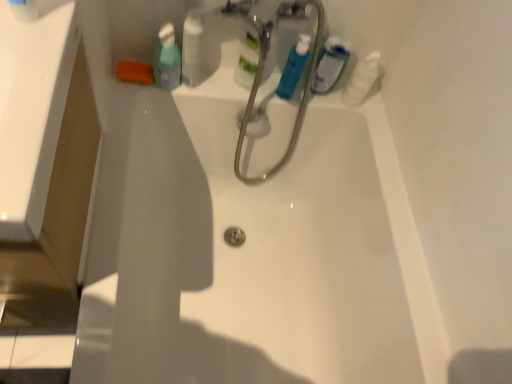
Question: From a real-world perspective, is white glossy bottle at upper center physically below translucent plastic mouthwash at upper center, acting as the 1th mouthwash starting from the left?

Choices:
 (A) yes
 (B) no

Answer: (B)

Question: Is white glossy bottle at upper center at the right side of translucent plastic mouthwash at upper center, acting as the 1th mouthwash starting from the left?

Choices:
 (A) yes
 (B) no

Answer: (A)

Question: Is white glossy bottle at upper center shorter than translucent plastic mouthwash at upper center, placed as the third mouthwash when sorted from right to left?

Choices:
 (A) yes
 (B) no

Answer: (B)

Question: Is white glossy bottle at upper center far away from translucent plastic mouthwash at upper center, placed as the third mouthwash when sorted from right to left?

Choices:
 (A) no
 (B) yes

Answer: (A)

Question: Is white glossy bottle at upper center facing towards translucent plastic mouthwash at upper center, acting as the 1th mouthwash starting from the left?

Choices:
 (A) yes
 (B) no

Answer: (B)

Question: From the image's perspective, is white glossy bottle at upper center on translucent plastic mouthwash at upper center, placed as the third mouthwash when sorted from right to left?

Choices:
 (A) yes
 (B) no

Answer: (A)

Question: Considering the relative sizes of white glossy bottle at upper center and translucent plastic mouthwash at upper right, which appears as the 1th mouthwash when viewed from the right, in the image provided, is white glossy bottle at upper center smaller than translucent plastic mouthwash at upper right, which appears as the 1th mouthwash when viewed from the right,?

Choices:
 (A) yes
 (B) no

Answer: (B)

Question: Is translucent plastic mouthwash at upper right, the 3th mouthwash in the left-to-right sequence, surrounded by white glossy bottle at upper center?

Choices:
 (A) no
 (B) yes

Answer: (A)

Question: Is white glossy bottle at upper center next to translucent plastic mouthwash at upper right, the 3th mouthwash in the left-to-right sequence?

Choices:
 (A) yes
 (B) no

Answer: (B)

Question: Does white glossy bottle at upper center have a lesser height compared to translucent plastic mouthwash at upper right, which appears as the 1th mouthwash when viewed from the right?

Choices:
 (A) yes
 (B) no

Answer: (B)

Question: From the image's perspective, is white glossy bottle at upper center below translucent plastic mouthwash at upper right, which appears as the 1th mouthwash when viewed from the right?

Choices:
 (A) yes
 (B) no

Answer: (B)

Question: Is white glossy bottle at upper center far from translucent plastic mouthwash at upper right, which appears as the 1th mouthwash when viewed from the right?

Choices:
 (A) no
 (B) yes

Answer: (A)

Question: Can you confirm if white glossy bottle at upper center is positioned to the left of blue glossy mouthwash at upper center, the 2th mouthwash when ordered from left to right?

Choices:
 (A) no
 (B) yes

Answer: (B)